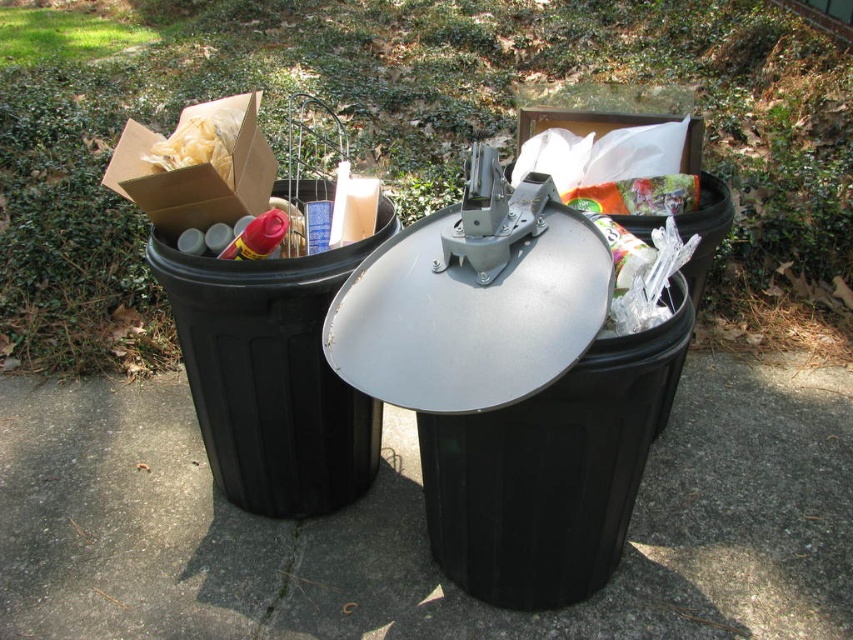
Question: Is black plastic bin at left smaller than cardboard box at upper left?

Choices:
 (A) no
 (B) yes

Answer: (A)

Question: Which of the following is the farthest from the observer?

Choices:
 (A) clear plastic bag at center
 (B) cardboard box at upper left

Answer: (A)

Question: Does black plastic pavement at center appear over black plastic bin at left?

Choices:
 (A) yes
 (B) no

Answer: (B)

Question: Which object appears farthest from the camera in this image?

Choices:
 (A) black plastic bin at left
 (B) clear plastic bag at center
 (C) black plastic pavement at center
 (D) white paper at upper left

Answer: (B)

Question: Which point appears farthest from the camera in this image?

Choices:
 (A) (109, 497)
 (B) (639, 218)
 (C) (270, 314)
 (D) (202, 161)

Answer: (A)

Question: Does black plastic pavement at center appear under black plastic bin at left?

Choices:
 (A) no
 (B) yes

Answer: (B)